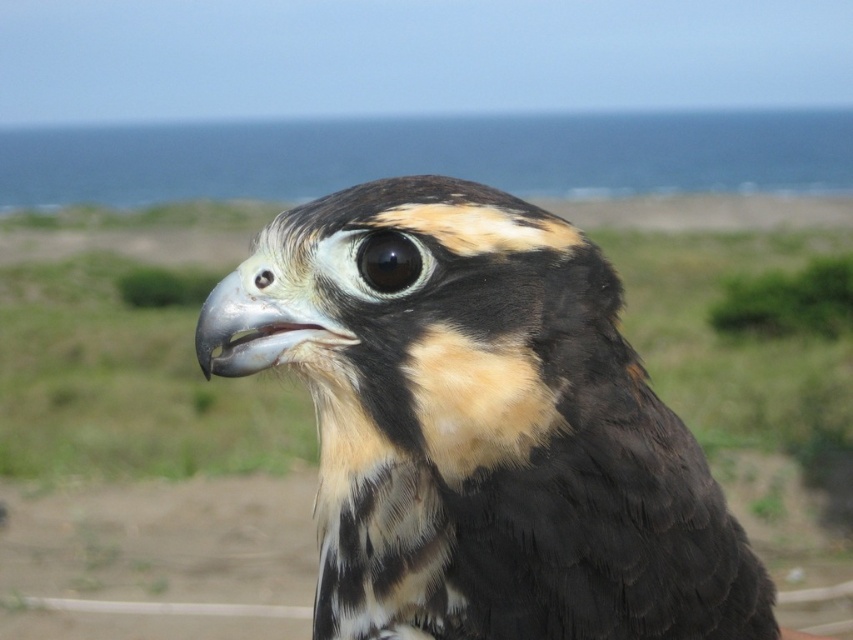
Between point (343, 337) and point (262, 273), which one is positioned behind?

The point (262, 273) is more distant.

Which of these two, black feathered eagle at center or black glossy eye at upper center, stands shorter?

black glossy eye at upper center is shorter.

Between point (546, 301) and point (260, 285), which one is positioned in front?

Point (546, 301) is more forward.

I want to click on black feathered eagle at center, so click(483, 429).

Who is shorter, black glossy eye at center or black glossy eye at upper center?

Standing shorter between the two is black glossy eye at upper center.

Is black glossy eye at center to the right of black glossy eye at upper center from the viewer's perspective?

Indeed, black glossy eye at center is positioned on the right side of black glossy eye at upper center.

Where is `black glossy eye at center`? The image size is (853, 640). black glossy eye at center is located at coordinates (392, 260).

Describe the element at coordinates (483, 429) in the screenshot. This screenshot has width=853, height=640. I see `black feathered eagle at center` at that location.

Who is more distant from viewer, [410,620] or [368,244]?

The point [368,244] is more distant.

Find the location of a particular element. The image size is (853, 640). black feathered eagle at center is located at coordinates (483, 429).